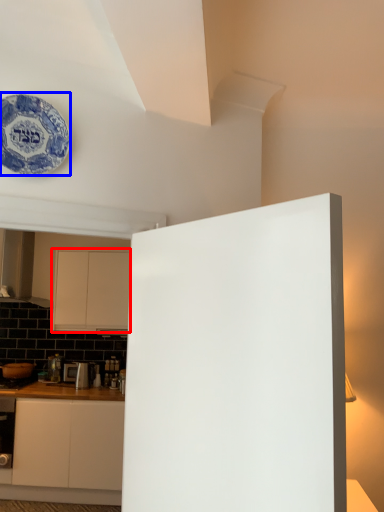
Question: Which object appears farthest to the camera in this image, cabinetry (highlighted by a red box) or plate (highlighted by a blue box)?

Choices:
 (A) cabinetry
 (B) plate

Answer: (A)